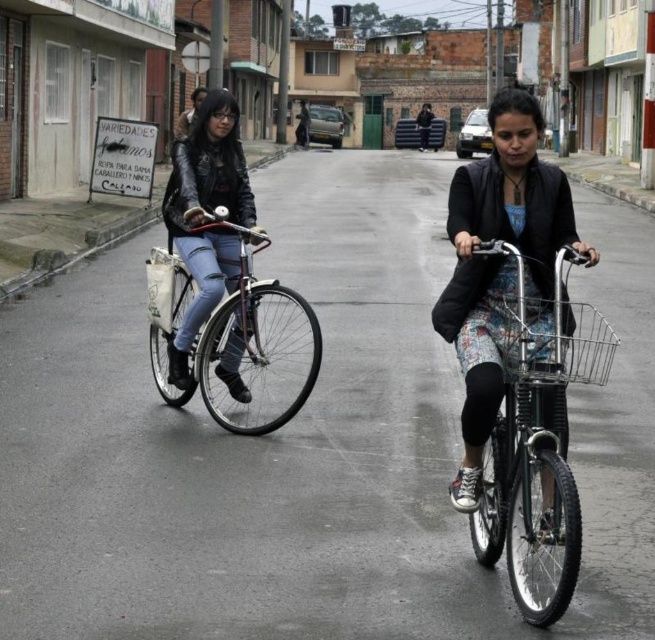
You are standing on the street and see both the metallic silver bicycle at center and the leather jacket at center. Which object is nearer to you?

The metallic silver bicycle at center is closer to you than the leather jacket at center.

You are a delivery person who needs to place a floral dress at center and a shiny metallic bicycle at center onto a narrow shelf that can only hold items with a combined width of 1 meter. Given their widths, can both items fit together on the shelf?

The floral dress at center is thinner than the shiny metallic bicycle at center. Since the dress is thinner, but the exact widths are not provided, we can only assume that their combined width might be under 1 meter. However, without specific measurements, it is uncertain if both items will fit together on the shelf.